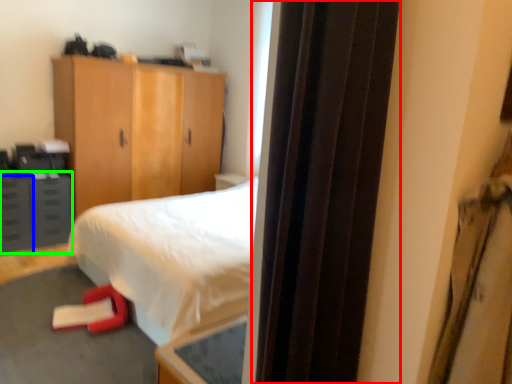
Question: Based on their relative distances, which object is nearer to screen door (highlighted by a red box)? Choose from drawer (highlighted by a blue box) and cabinetry (highlighted by a green box).

Choices:
 (A) drawer
 (B) cabinetry

Answer: (B)